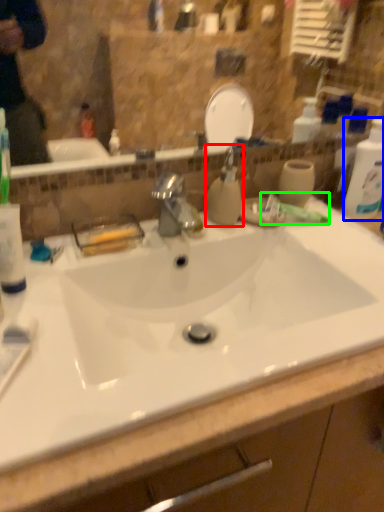
Question: Based on their relative distances, which object is nearer to soap dispenser (highlighted by a red box)? Choose from cleaning product (highlighted by a blue box) and toothpaste (highlighted by a green box).

Choices:
 (A) cleaning product
 (B) toothpaste

Answer: (B)